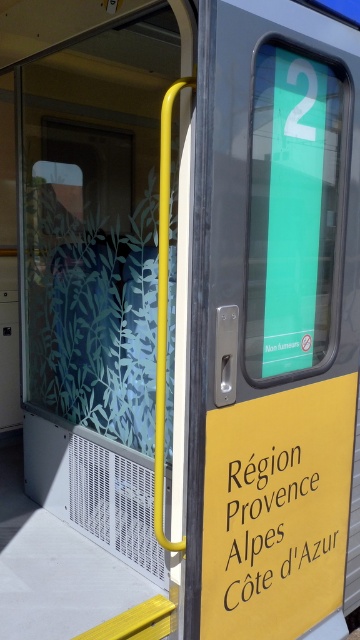
You are standing in front of the train door and want to locate the yellow matte signboard at center. According to the destination sign, what are the coordinates where you should look?

The yellow matte signboard at center is located at point (280, 321).

You are a passenger standing at the train door and want to read the yellow matte signboard at center. Can you reach it without moving closer?

The yellow matte signboard at center is 1.57 meters away from the camera, so you can reach it without moving closer if your arm can extend that far.